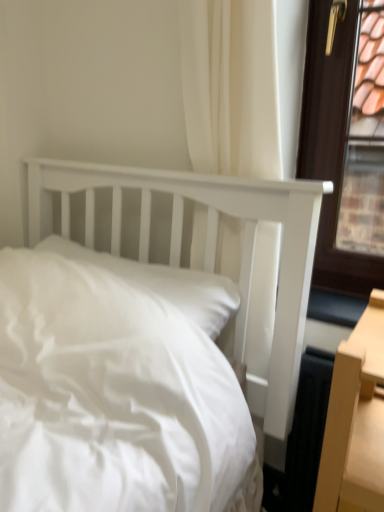
Image resolution: width=384 pixels, height=512 pixels. Identify the location of white smooth pillow at center. (164, 283).

What do you see at coordinates (164, 283) in the screenshot? The width and height of the screenshot is (384, 512). I see `white smooth pillow at center` at bounding box center [164, 283].

Measure the distance between white smooth pillow at center and camera.

white smooth pillow at center and camera are 36.30 inches apart from each other.

Identify the location of white fabric curtain at upper center. The image size is (384, 512). coord(230,87).

What do you see at coordinates (230, 87) in the screenshot? I see `white fabric curtain at upper center` at bounding box center [230, 87].

Image resolution: width=384 pixels, height=512 pixels. Identify the location of white smooth pillow at center. (164, 283).

Would you say white smooth pillow at center is to the left or to the right of white fabric curtain at upper center in the picture?

white smooth pillow at center is positioned on white fabric curtain at upper center's left side.

Which object is further away from the camera taking this photo, white smooth pillow at center or white fabric curtain at upper center?

white smooth pillow at center is behind.

Considering the points (56, 251) and (229, 258), which point is behind, point (56, 251) or point (229, 258)?

The point (56, 251) is behind.

From the image's perspective, is white smooth pillow at center above or below white fabric curtain at upper center?

Based on their image positions, white smooth pillow at center is located beneath white fabric curtain at upper center.

From a real-world perspective, is white smooth pillow at center located beneath white fabric curtain at upper center?

Indeed, from a real-world perspective, white smooth pillow at center is positioned beneath white fabric curtain at upper center.

Which object is wider, white smooth pillow at center or white fabric curtain at upper center?

white smooth pillow at center is wider.

Who is taller, white smooth pillow at center or white fabric curtain at upper center?

white fabric curtain at upper center.

Is white smooth pillow at center bigger than white fabric curtain at upper center?

Incorrect, white smooth pillow at center is not larger than white fabric curtain at upper center.

Is white smooth pillow at center surrounding white fabric curtain at upper center?

Definitely not — white fabric curtain at upper center is not inside white smooth pillow at center.

Based on the photo, is white smooth pillow at center directly adjacent to white fabric curtain at upper center?

No, white smooth pillow at center is not beside white fabric curtain at upper center.

Could you tell me if white smooth pillow at center is turned towards white fabric curtain at upper center?

No, white smooth pillow at center is not oriented towards white fabric curtain at upper center.

The image size is (384, 512). In order to click on curtain lying in front of the white smooth pillow at center in this screenshot , I will do 230,87.

Considering the positions of objects white fabric curtain at upper center and white smooth pillow at center in the image provided, who is more to the left, white fabric curtain at upper center or white smooth pillow at center?

white smooth pillow at center.

Consider the image. Is white fabric curtain at upper center in front of or behind white smooth pillow at center in the image?

In the image, white fabric curtain at upper center appears in front of white smooth pillow at center.

Between point (272, 255) and point (208, 319), which one is positioned in front?

The point (208, 319) is more forward.

From the image's perspective, which one is positioned lower, white fabric curtain at upper center or white smooth pillow at center?

white smooth pillow at center, from the image's perspective.

From a real-world perspective, is white fabric curtain at upper center above or below white smooth pillow at center?

Clearly, from a real-world perspective, white fabric curtain at upper center is above white smooth pillow at center.

Between white fabric curtain at upper center and white smooth pillow at center, which one has smaller width?

With smaller width is white fabric curtain at upper center.

Can you confirm if white fabric curtain at upper center is shorter than white smooth pillow at center?

No, white fabric curtain at upper center is not shorter than white smooth pillow at center.

Can you confirm if white fabric curtain at upper center is bigger than white smooth pillow at center?

Correct, white fabric curtain at upper center is larger in size than white smooth pillow at center.

Choose the correct answer: Is white fabric curtain at upper center inside white smooth pillow at center or outside it?

white fabric curtain at upper center is not inside white smooth pillow at center, it's outside.

Looking at this image, is white fabric curtain at upper center next to white smooth pillow at center?

No, white fabric curtain at upper center is not beside white smooth pillow at center.

Is white fabric curtain at upper center turned away from white smooth pillow at center?

No, white smooth pillow at center is not at the back of white fabric curtain at upper center.

Can you tell me how much white fabric curtain at upper center and white smooth pillow at center differ in facing direction?

1.66 degrees.

Locate an element on the screen. This screenshot has height=512, width=384. pillow behind the white fabric curtain at upper center is located at coordinates (164, 283).

Where is `pillow behind the white fabric curtain at upper center`? pillow behind the white fabric curtain at upper center is located at coordinates (164, 283).

Find the location of a particular element. Image resolution: width=384 pixels, height=512 pixels. curtain that appears in front of the white smooth pillow at center is located at coordinates (230, 87).